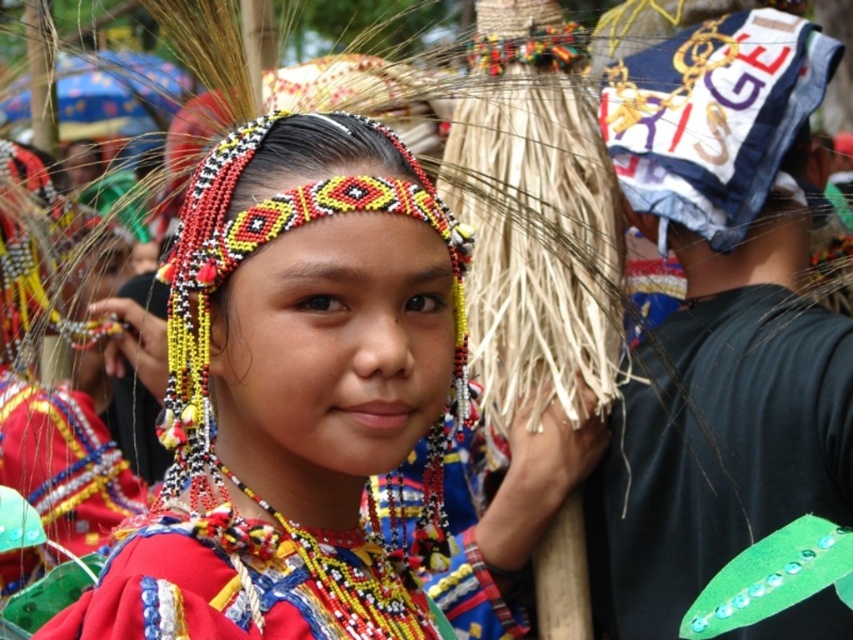
Question: Does beaded headband at center appear on the left side of green beaded leaf at right?

Choices:
 (A) yes
 (B) no

Answer: (A)

Question: Which of the following is the closest to the observer?

Choices:
 (A) beaded fabric necklace at center
 (B) green beaded leaf at right

Answer: (A)

Question: Based on their relative distances, which object is nearer to the beaded fabric necklace at center?

Choices:
 (A) beaded headband at center
 (B) green beaded leaf at right

Answer: (A)

Question: Can you confirm if beaded headband at center is positioned above beaded fabric necklace at center?

Choices:
 (A) no
 (B) yes

Answer: (B)

Question: Observing the image, what is the correct spatial positioning of beaded headband at center in reference to green beaded leaf at right?

Choices:
 (A) right
 (B) left

Answer: (B)

Question: Which point is farther to the camera?

Choices:
 (A) beaded fabric necklace at center
 (B) green beaded leaf at right

Answer: (B)